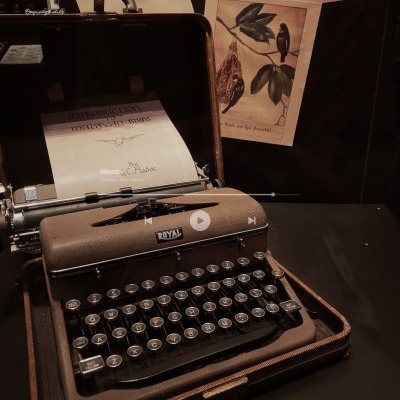
At what (x,y) coordinates should I click in order to perform the action: click on z key on the typewriter. Please return your answer as a coordinate pair (x, y). This screenshot has height=400, width=400. Looking at the image, I should click on (116, 361).